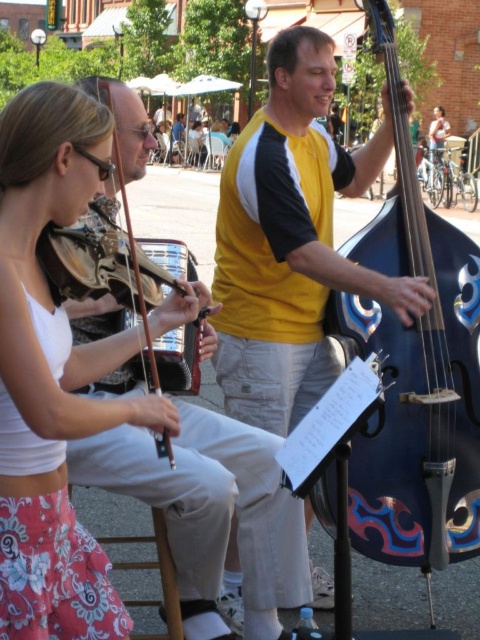
Question: Estimate the real-world distances between objects in this image. Which object is farther from the blue painted wood cello at center?

Choices:
 (A) matte brown violin at left
 (B) yellow jersey at center

Answer: (A)

Question: Can you confirm if yellow jersey at center is positioned below blue painted wood cello at center?

Choices:
 (A) yes
 (B) no

Answer: (A)

Question: Does blue painted wood cello at center have a larger size compared to matte brown violin at left?

Choices:
 (A) yes
 (B) no

Answer: (A)

Question: Which object is the farthest from the blue painted wood cello at center?

Choices:
 (A) matte brown violin at left
 (B) yellow jersey at center

Answer: (A)

Question: Based on their relative distances, which object is nearer to the matte brown violin at left?

Choices:
 (A) blue painted wood cello at center
 (B) yellow jersey at center

Answer: (B)

Question: Is yellow jersey at center to the left of blue painted wood cello at center from the viewer's perspective?

Choices:
 (A) no
 (B) yes

Answer: (B)